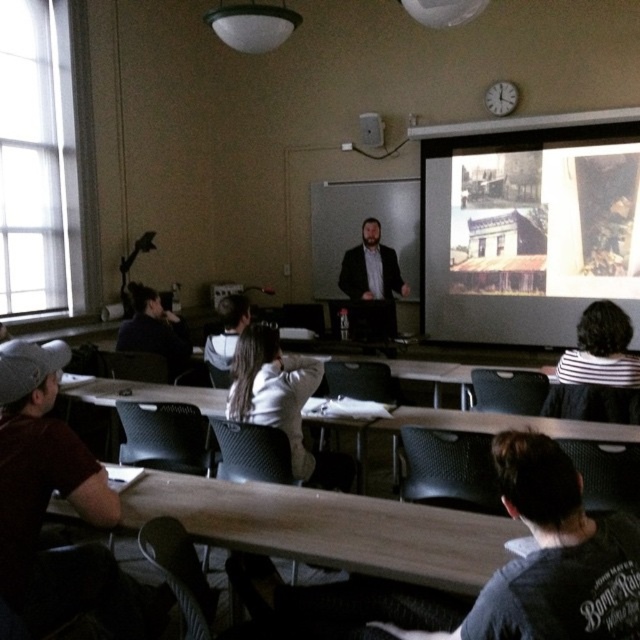
Can you confirm if dark red t-shirt at left is shorter than dark brown hair at left?

No, dark red t-shirt at left is not shorter than dark brown hair at left.

Between point (29, 422) and point (145, 337), which one is positioned behind?

Positioned behind is point (145, 337).

The width and height of the screenshot is (640, 640). I want to click on dark red t-shirt at left, so click(49, 497).

Who is more distant from viewer, [348,284] or [136,291]?

Positioned behind is point [348,284].

Does dark brown suit at center have a larger size compared to dark brown hair at left?

No, dark brown suit at center is not bigger than dark brown hair at left.

Which is in front, point (381, 288) or point (172, 317)?

Point (172, 317) is in front.

Find the location of a particular element. This screenshot has height=640, width=640. dark brown suit at center is located at coordinates (372, 272).

Which is in front, point (544, 308) or point (390, 317)?

Positioned in front is point (390, 317).

Who is lower down, matte black screen at upper right or dark brown suit at center?

dark brown suit at center is lower down.

Is point (608, 228) farther from viewer compared to point (380, 243)?

That is False.

Image resolution: width=640 pixels, height=640 pixels. In order to click on matte black screen at upper right in this screenshot , I will do `click(529, 227)`.